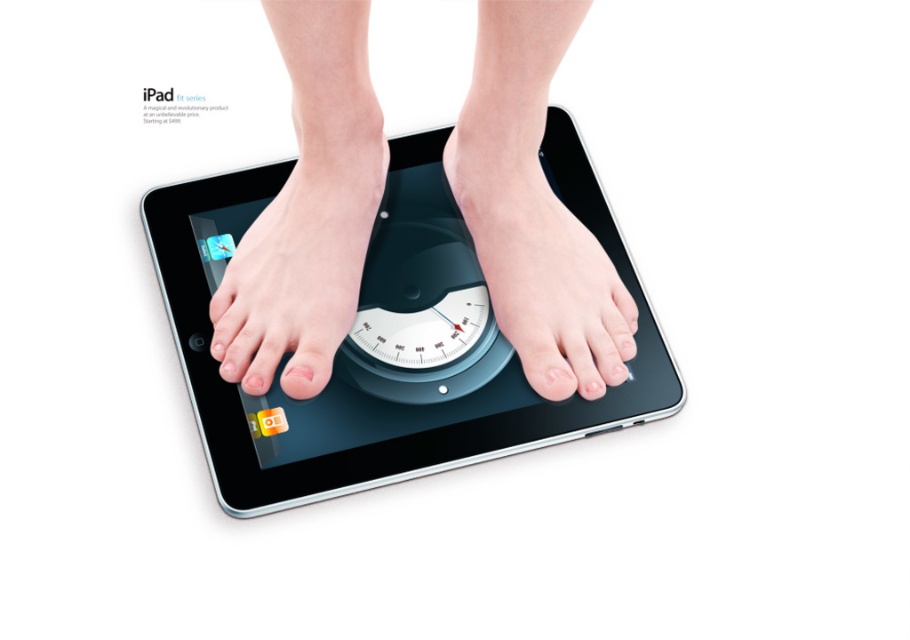
Question: Is smooth skin feet at center positioned before skinny white foot at center?

Choices:
 (A) no
 (B) yes

Answer: (B)

Question: Which of these objects is positioned closest to the pale skin foot at center?

Choices:
 (A) smooth skin feet at center
 (B) skinny white foot at center
 (C) black glossy tablet at center

Answer: (A)

Question: Estimate the real-world distances between objects in this image. Which object is closer to the black glossy tablet at center?

Choices:
 (A) smooth skin feet at center
 (B) pale skin foot at center
 (C) skinny white foot at center

Answer: (A)

Question: Which point is farther from the camera taking this photo?

Choices:
 (A) (302, 147)
 (B) (265, 348)
 (C) (471, 192)
 (D) (562, 416)

Answer: (C)

Question: Is smooth skin feet at center further to camera compared to pale skin foot at center?

Choices:
 (A) no
 (B) yes

Answer: (A)

Question: Can you confirm if black glossy tablet at center is positioned above pale skin foot at center?

Choices:
 (A) yes
 (B) no

Answer: (B)